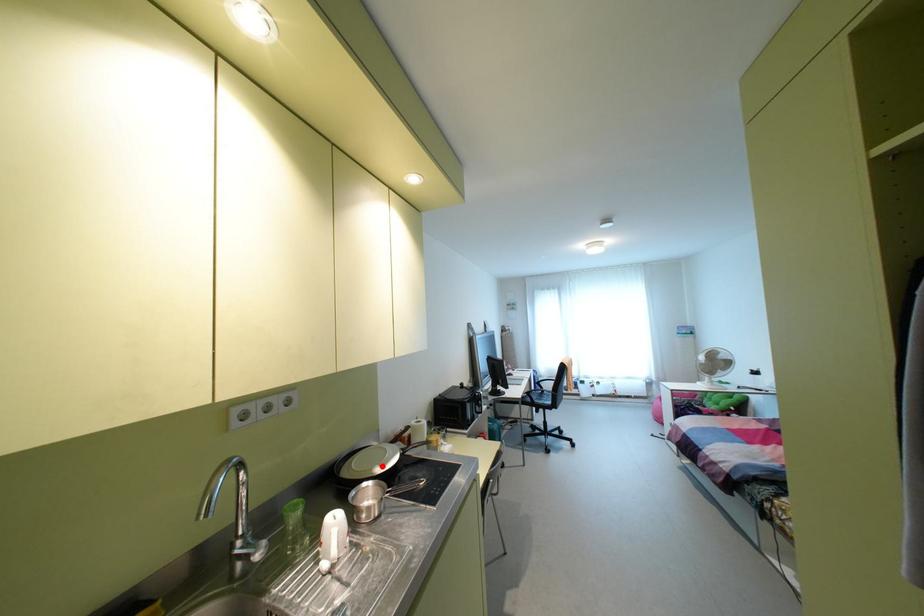
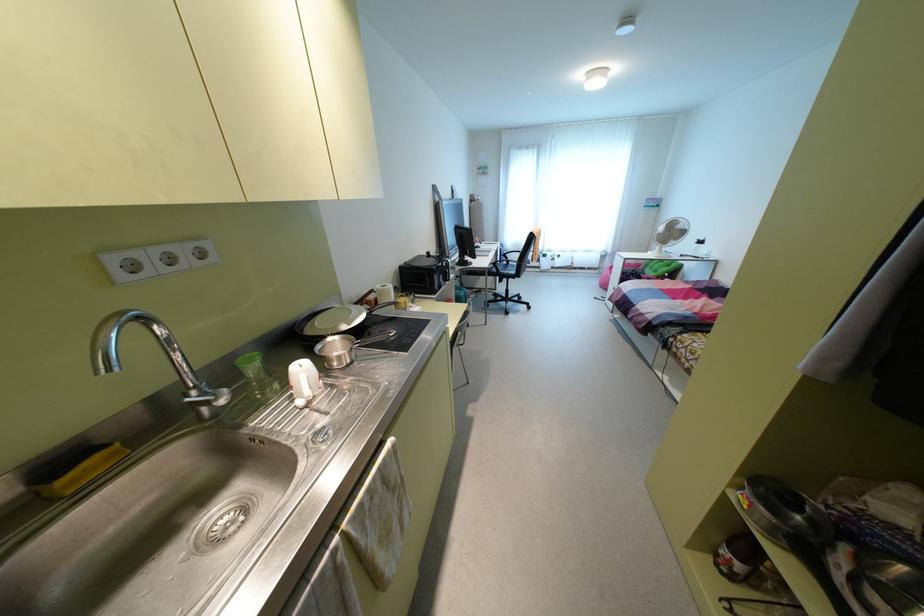
In the second image, find the point that corresponds to the highlighted location in the first image.

(348, 323)